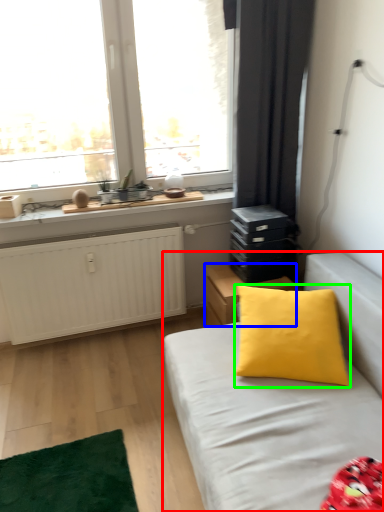
Question: Which is farther away from studio couch (highlighted by a red box)? nightstand (highlighted by a blue box) or pillow (highlighted by a green box)?

Choices:
 (A) nightstand
 (B) pillow

Answer: (A)